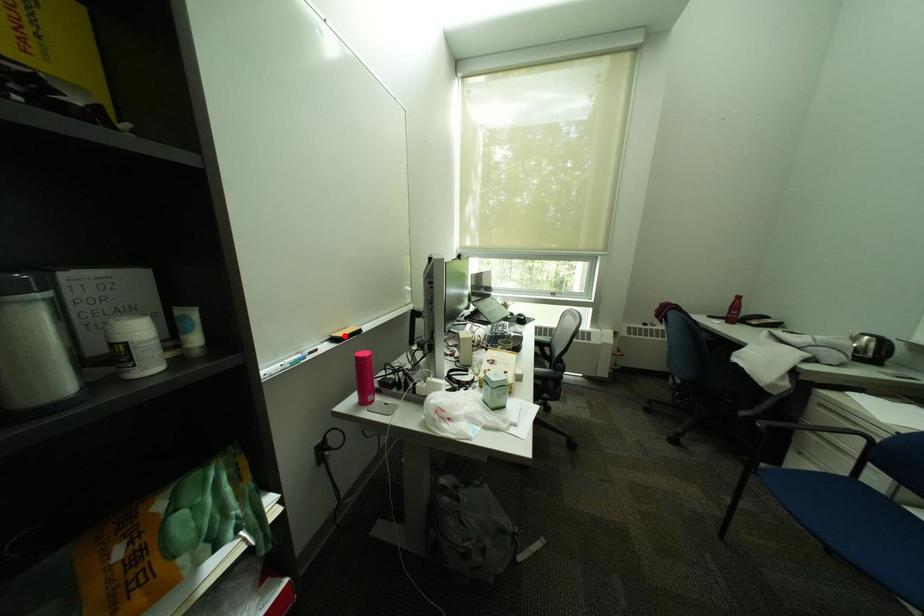
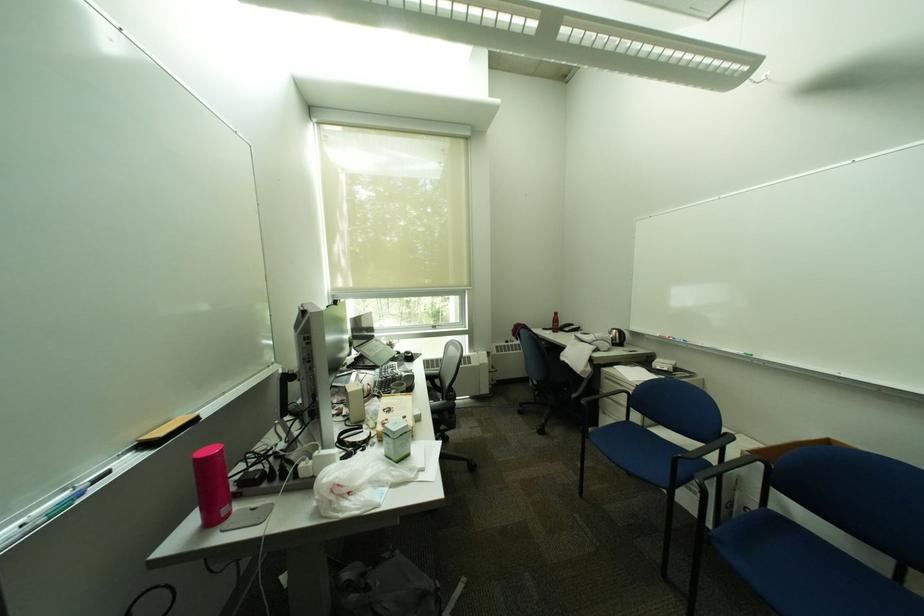
Find the pixel in the second image that matches the highlighted location in the first image.

(155, 439)